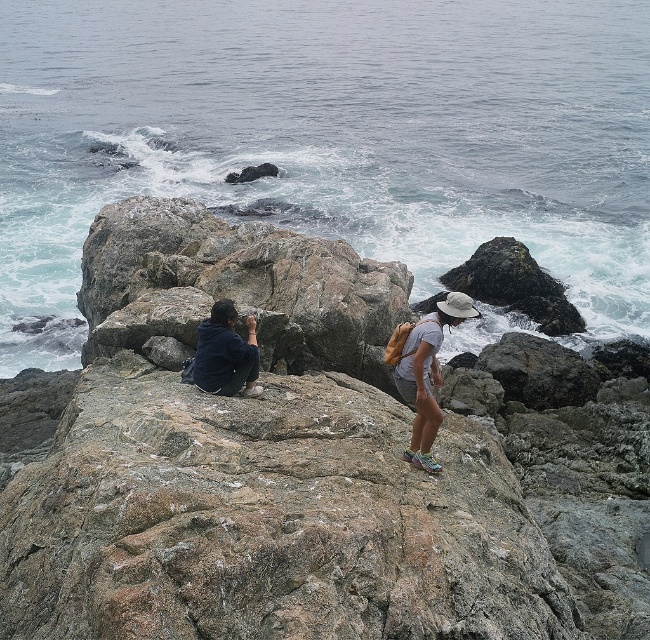
Does white frothy water at upper center have a larger size compared to dark blue shirt at center?

Yes, white frothy water at upper center is bigger than dark blue shirt at center.

Image resolution: width=650 pixels, height=640 pixels. What do you see at coordinates (330, 140) in the screenshot?
I see `white frothy water at upper center` at bounding box center [330, 140].

Is point (332, 86) positioned after point (248, 358)?

Yes, point (332, 86) is farther from viewer.

Where is `white frothy water at upper center`? white frothy water at upper center is located at coordinates (330, 140).

Based on the photo, does white frothy water at upper center have a larger size compared to dark blue jacket at center?

Indeed, white frothy water at upper center has a larger size compared to dark blue jacket at center.

Is point (40, 209) positioned before point (213, 352)?

No, (40, 209) is further to viewer.

Is point (614, 266) more distant than point (406, 449)?

That is True.

At what (x,y) coordinates should I click in order to perform the action: click on white frothy water at upper center. Please return your answer as a coordinate pair (x, y). Looking at the image, I should click on (330, 140).

How much distance is there between dark blue jacket at center and matte gray shorts at center?

They are 1.61 inches apart.

Is point (417, 449) closer to camera compared to point (429, 452)?

No, (417, 449) is further to viewer.

At what (x,y) coordinates should I click in order to perform the action: click on dark blue jacket at center. Please return your answer as a coordinate pair (x, y). This screenshot has height=640, width=650. Looking at the image, I should click on (424, 371).